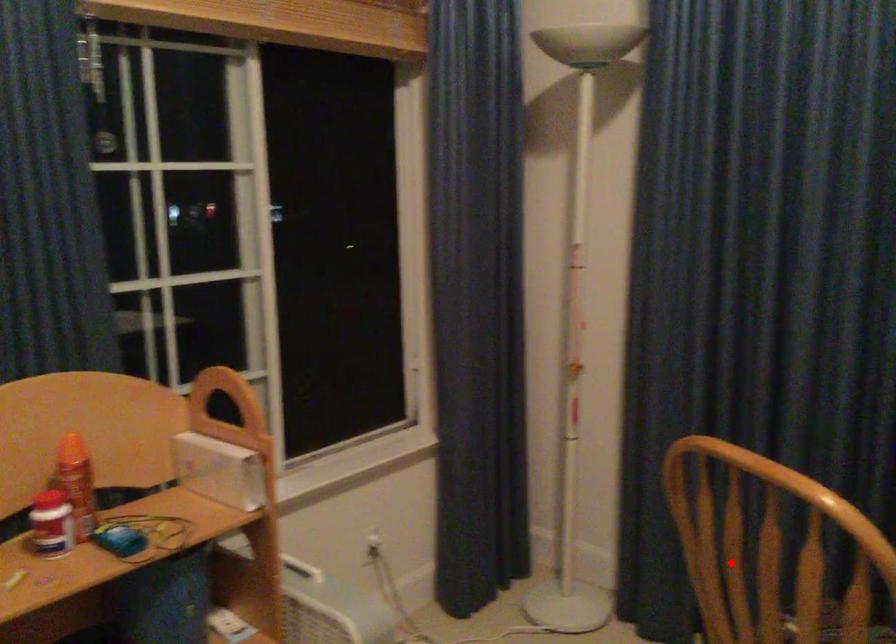
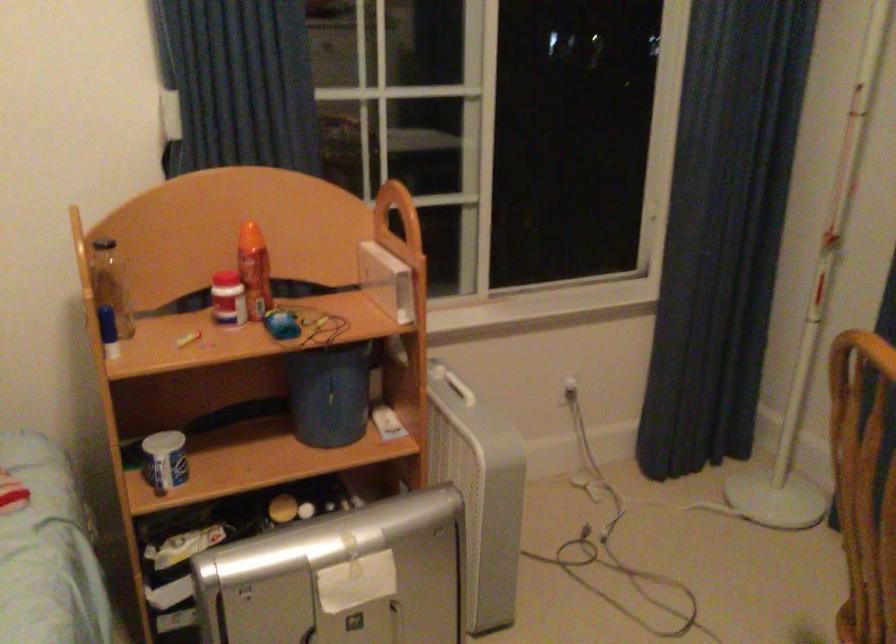
Question: I am providing you with two images of the same scene from different viewpoints. A red point is marked on the first image. At the location where the point appears in image 1, is it still visible in image 2?

Choices:
 (A) Yes
 (B) No

Answer: (A)